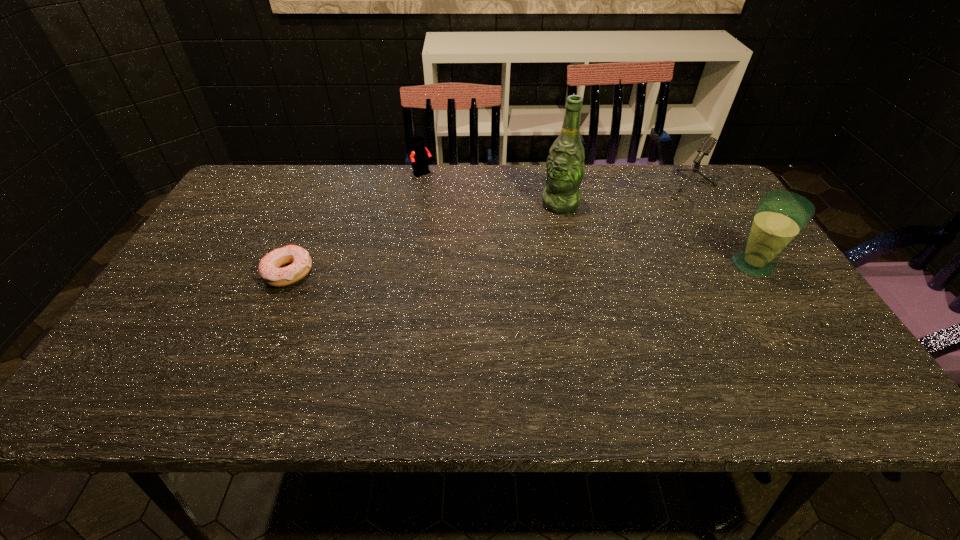
I want to click on vacant space on the desktop that is between the leftmost object and the fourth shortest object and is positioned on the front-facing side of the second object from left to right, so click(499, 269).

The height and width of the screenshot is (540, 960). Identify the location of free space on the desktop that is between the leftmost object and the second tallest object and is positioned on the stand of the microphone. (587, 268).

Locate an element on the screen. vacant space on the desktop that is between the doughnut and the fourth shortest object and is positioned on the surface of the third object from right to left is located at coordinates (497, 269).